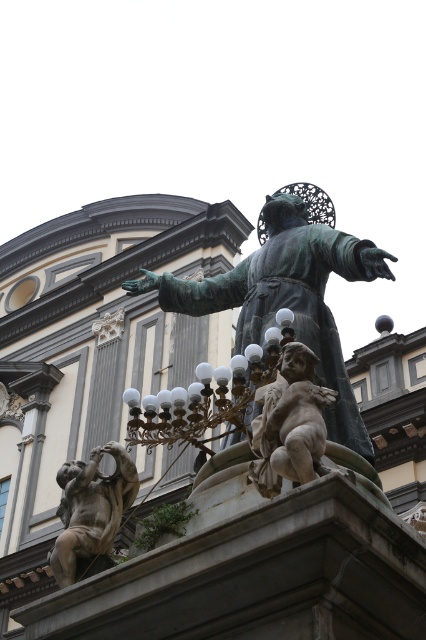
Question: Is green patina statue at center positioned in front of bronze lamp at center?

Choices:
 (A) no
 (B) yes

Answer: (B)

Question: Is smooth beige cherub at center below bronze cherub at lower left?

Choices:
 (A) yes
 (B) no

Answer: (B)

Question: In this image, where is bronze lamp at center located relative to smooth beige cherub at center?

Choices:
 (A) above
 (B) below

Answer: (B)

Question: Which object is farther from the camera taking this photo?

Choices:
 (A) bronze lamp at center
 (B) bronze cherub at lower left
 (C) smooth beige cherub at center

Answer: (A)

Question: Which point is farther to the camera?

Choices:
 (A) bronze lamp at center
 (B) smooth beige cherub at center

Answer: (A)

Question: Which point appears farthest from the camera in this image?

Choices:
 (A) 218,419
 (B) 294,362
 (C) 86,516

Answer: (A)